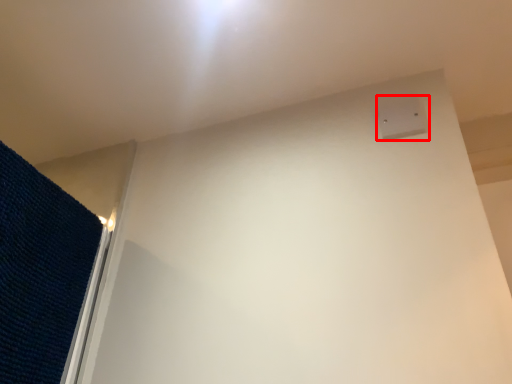
Question: From the image's perspective, considering the relative positions of electric outlet (annotated by the red box) and mat in the image provided, where is electric outlet (annotated by the red box) located with respect to the staircase?

Choices:
 (A) below
 (B) above

Answer: (B)